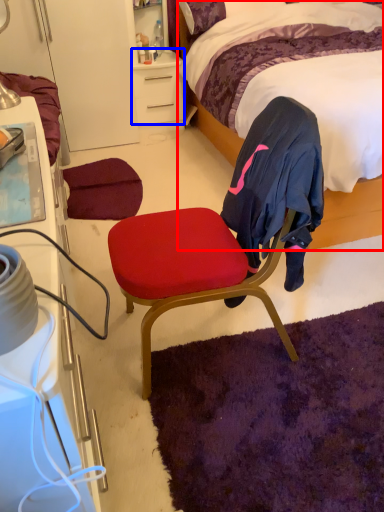
Question: Among these objects, which one is farthest to the camera, bed (highlighted by a red box) or desk (highlighted by a blue box)?

Choices:
 (A) bed
 (B) desk

Answer: (B)